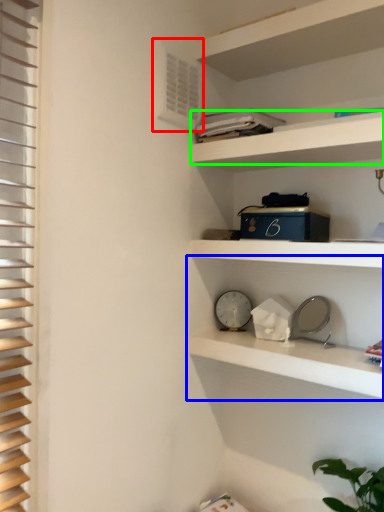
Question: Based on their relative distances, which object is farther from air conditioning (highlighted by a red box)? Choose from shelf (highlighted by a blue box) and cabinet (highlighted by a green box).

Choices:
 (A) shelf
 (B) cabinet

Answer: (A)